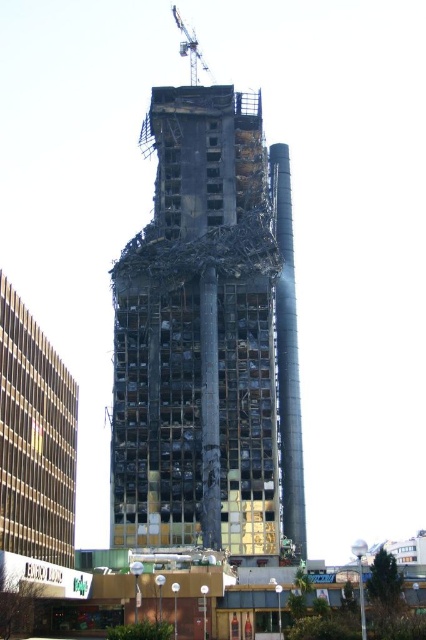
You are an engineer assessing the demolition site. You notice the charcoal concrete tower at center and the metallic gray crane at upper center. Which structure is taller?

The charcoal concrete tower at center is taller than the metallic gray crane at upper center according to the description.

You are an engineer assessing the demolition site. You see the charcoal concrete tower at center and the metallic gray crane at upper center. Which object is positioned higher in the image?

The metallic gray crane at upper center is positioned higher than the charcoal concrete tower at center.

You are standing at the base of the demolition site and see two points marked on the building. The first point is at coordinate point(276, 477) and the second is at point(189, 74). Which point is closer to you?

Point(276, 477) is in front of point(189, 74), so the first point is closer to you.